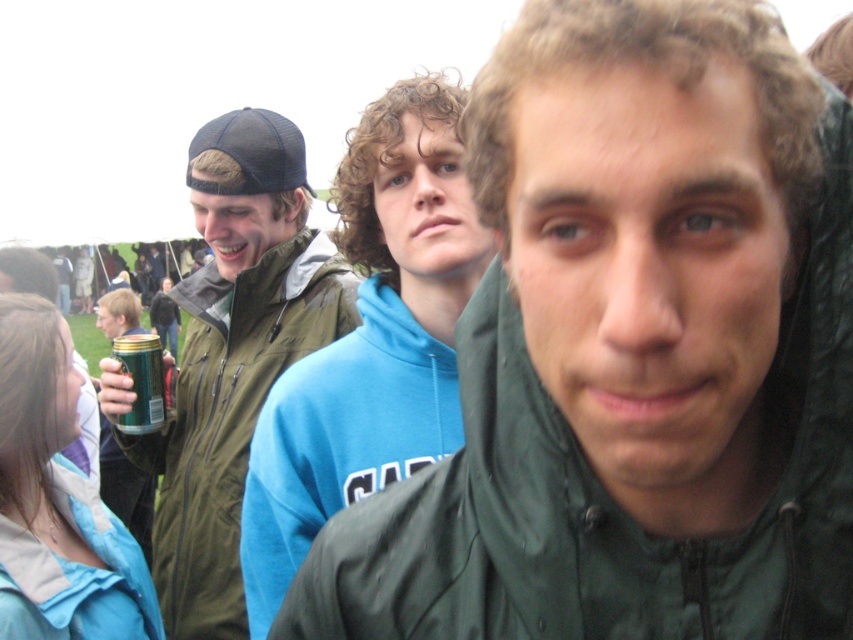
Question: Does blue fleece at center have a greater width compared to green matte jacket at left?

Choices:
 (A) no
 (B) yes

Answer: (A)

Question: Which object is closer to the camera taking this photo?

Choices:
 (A) green matte can at center-left
 (B) green matte jacket at left
 (C) blue fleece at center
 (D) green matte jacket at center

Answer: (D)

Question: Which point is closer to the camera?

Choices:
 (A) (148, 371)
 (B) (280, 536)
 (C) (480, 464)
 (D) (212, 474)

Answer: (C)

Question: Can you confirm if blue fleece at center is wider than green matte can at center-left?

Choices:
 (A) yes
 (B) no

Answer: (A)

Question: Is green matte jacket at left smaller than green matte can at center-left?

Choices:
 (A) yes
 (B) no

Answer: (B)

Question: Estimate the real-world distances between objects in this image. Which object is closer to the green matte can at center-left?

Choices:
 (A) blue fleece at center
 (B) green matte jacket at left

Answer: (B)